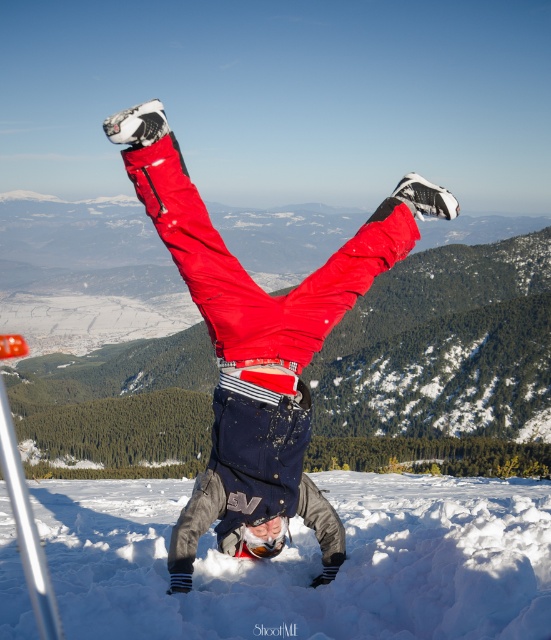
Is white fluffy snow at center bigger than matte red pants at center?

Yes.

Can you confirm if white fluffy snow at center is shorter than matte red pants at center?

Correct, white fluffy snow at center is not as tall as matte red pants at center.

I want to click on white fluffy snow at center, so tap(306, 563).

This screenshot has width=551, height=640. I want to click on white fluffy snow at center, so click(x=306, y=563).